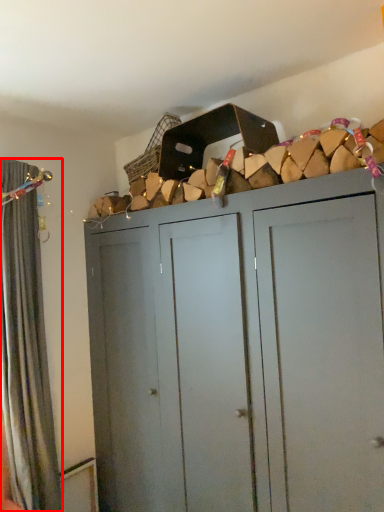
Question: Considering the relative positions of curtain (annotated by the red box) and cupboard in the image provided, where is curtain (annotated by the red box) located with respect to the staircase?

Choices:
 (A) left
 (B) right

Answer: (A)